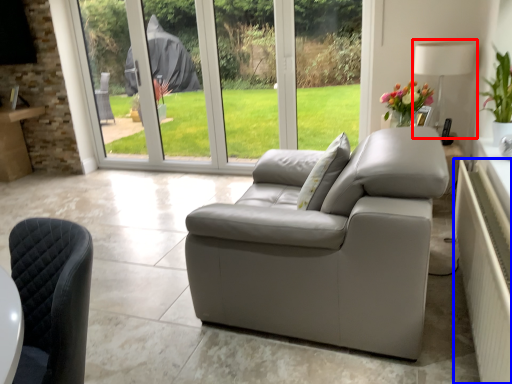
Question: Which object appears farthest to the camera in this image, lamp (highlighted by a red box) or radiator (highlighted by a blue box)?

Choices:
 (A) lamp
 (B) radiator

Answer: (A)